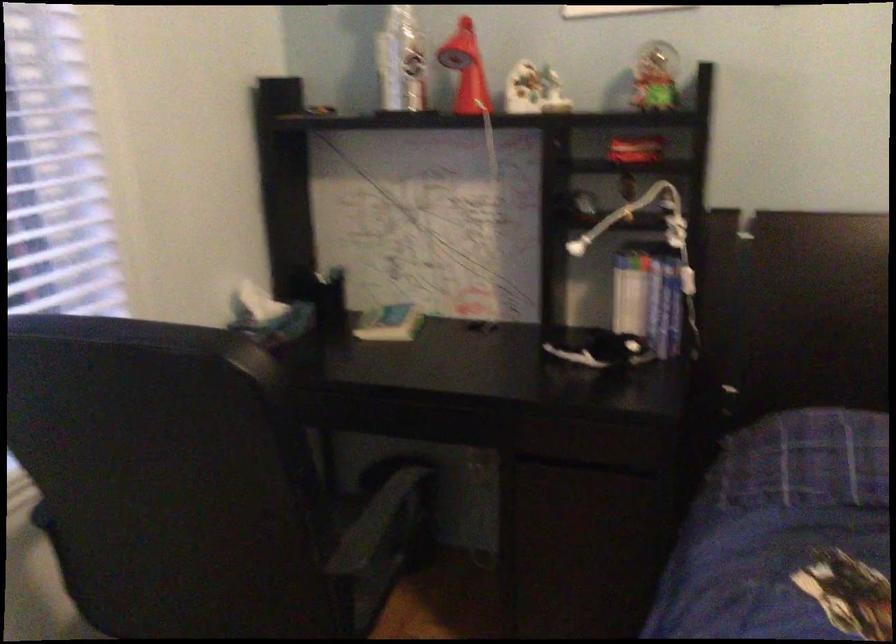
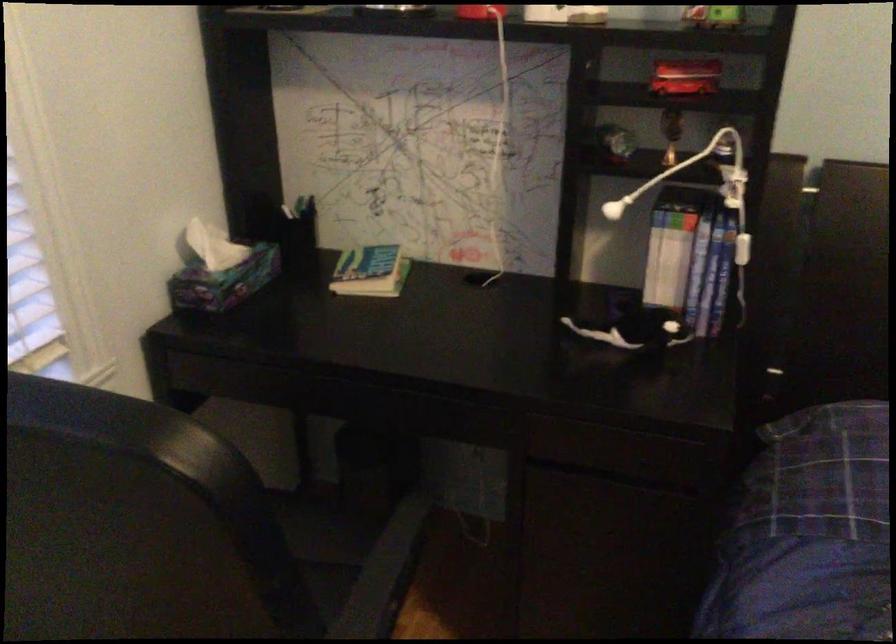
Locate, in the second image, the point that corresponds to pixel 256 299 in the first image.

(213, 245)